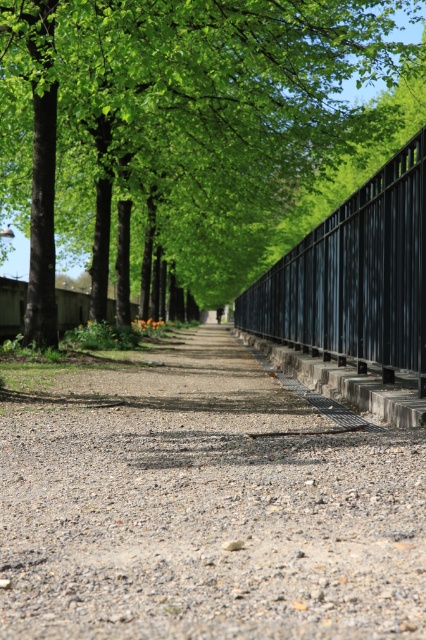
Question: Does gravelly dirt path at center come in front of black metal fence at right?

Choices:
 (A) no
 (B) yes

Answer: (B)

Question: Estimate the real-world distances between objects in this image. Which object is farther from the green leafy tree at center?

Choices:
 (A) gravelly dirt path at center
 (B) black metal fence at right

Answer: (A)

Question: Is gravelly dirt path at center wider than black metal fence at right?

Choices:
 (A) yes
 (B) no

Answer: (A)

Question: Does gravelly dirt path at center have a smaller size compared to green leafy tree at center?

Choices:
 (A) no
 (B) yes

Answer: (B)

Question: Among these objects, which one is farthest from the camera?

Choices:
 (A) gravelly dirt path at center
 (B) green leafy tree at center

Answer: (B)

Question: Which object is closer to the camera taking this photo?

Choices:
 (A) green leafy tree at center
 (B) black metal fence at right

Answer: (B)